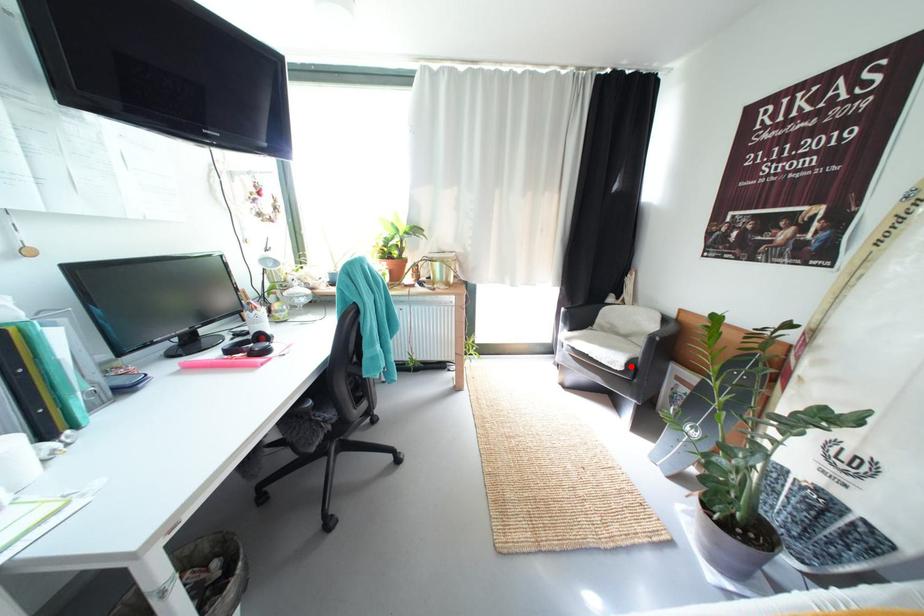
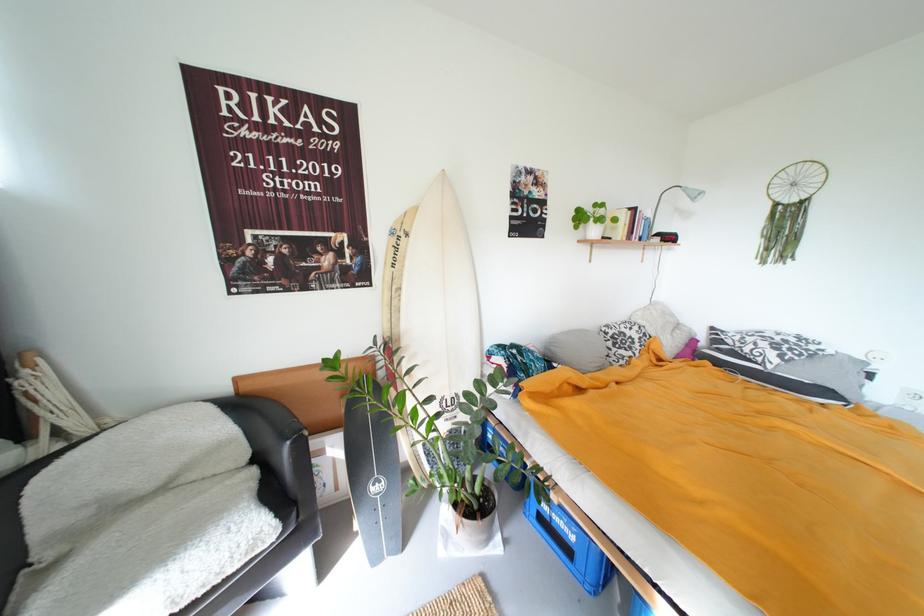
In the second image, find the point that corresponds to the highlighted location in the first image.

(284, 524)